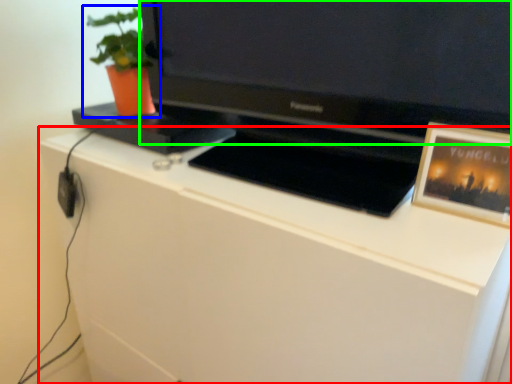
Question: Which object is the closest to the cabinetry (highlighted by a red box)? Choose among these: houseplant (highlighted by a blue box) or television (highlighted by a green box).

Choices:
 (A) houseplant
 (B) television

Answer: (B)